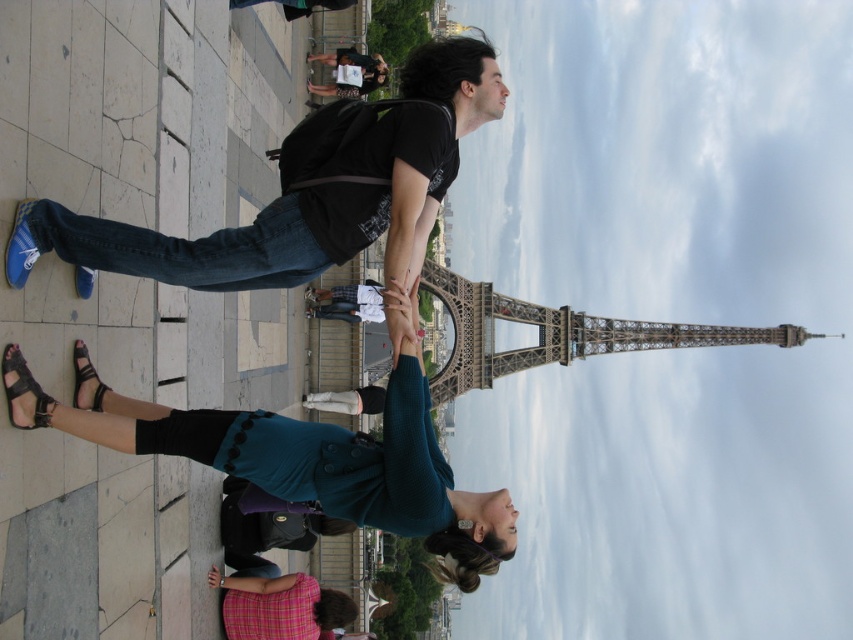
You are a photographer trying to capture a photo of the gray metal eiffel tower at center and the teal fabric sweater at lower center. Based on their thickness, which object should you focus on first to ensure both are in sharp focus?

The teal fabric sweater at lower center is thinner than the gray metal eiffel tower at center, so you should focus on the gray metal eiffel tower at center first to ensure both are in sharp focus.

Based on the photo, you are a photographer planning to take a photo of the gray metal eiffel tower at center and the blue denim jeans at left. Based on their positions, which object should you focus on first if you want to capture both in a single frame without moving the camera?

The blue denim jeans at left is to the left of gray metal eiffel tower at center, so you should focus on the gray metal eiffel tower at center first to ensure both are in frame.